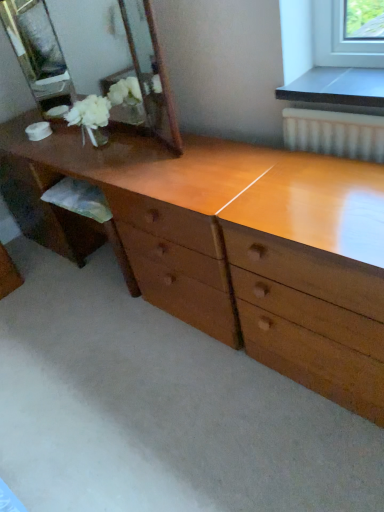
Question: Is the position of wooden mirror at upper left more distant than that of wooden dresser at center?

Choices:
 (A) yes
 (B) no

Answer: (A)

Question: Does wooden mirror at upper left come in front of wooden dresser at center?

Choices:
 (A) no
 (B) yes

Answer: (A)

Question: Is wooden mirror at upper left directly adjacent to wooden dresser at center?

Choices:
 (A) yes
 (B) no

Answer: (B)

Question: From a real-world perspective, is wooden mirror at upper left physically below wooden dresser at center?

Choices:
 (A) yes
 (B) no

Answer: (B)

Question: Is there a large distance between wooden mirror at upper left and wooden dresser at center?

Choices:
 (A) no
 (B) yes

Answer: (B)

Question: Is wooden mirror at upper left turned away from wooden dresser at center?

Choices:
 (A) no
 (B) yes

Answer: (A)

Question: Does wooden dresser at center have a larger size compared to wooden mirror at upper left?

Choices:
 (A) yes
 (B) no

Answer: (A)

Question: Does wooden dresser at center have a smaller size compared to wooden mirror at upper left?

Choices:
 (A) yes
 (B) no

Answer: (B)

Question: Is wooden dresser at center with wooden mirror at upper left?

Choices:
 (A) no
 (B) yes

Answer: (A)

Question: Does wooden dresser at center appear on the left side of wooden mirror at upper left?

Choices:
 (A) no
 (B) yes

Answer: (A)

Question: Is wooden dresser at center behind wooden mirror at upper left?

Choices:
 (A) yes
 (B) no

Answer: (B)

Question: Can you confirm if wooden dresser at center is thinner than wooden mirror at upper left?

Choices:
 (A) yes
 (B) no

Answer: (B)

Question: From a real-world perspective, relative to wooden dresser at center, is wooden mirror at upper left vertically above or below?

Choices:
 (A) above
 (B) below

Answer: (A)